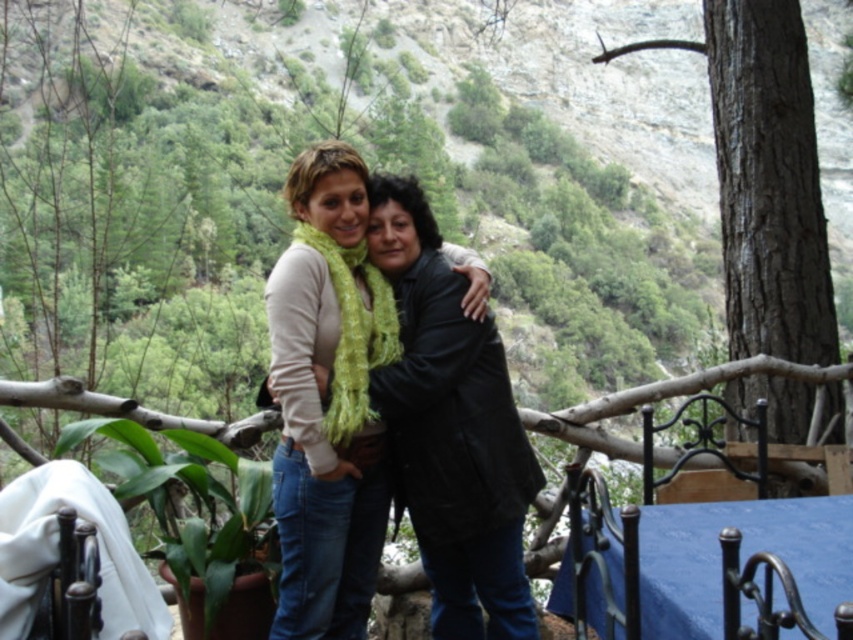
Which is more to the right, light beige sweater at center or blue fabric tablecloth at lower right?

blue fabric tablecloth at lower right is more to the right.

In the scene shown: Does light beige sweater at center have a larger size compared to blue fabric tablecloth at lower right?

Yes, light beige sweater at center is bigger than blue fabric tablecloth at lower right.

Is point (492, 632) more distant than point (718, 525)?

Yes.

I want to click on light beige sweater at center, so click(451, 428).